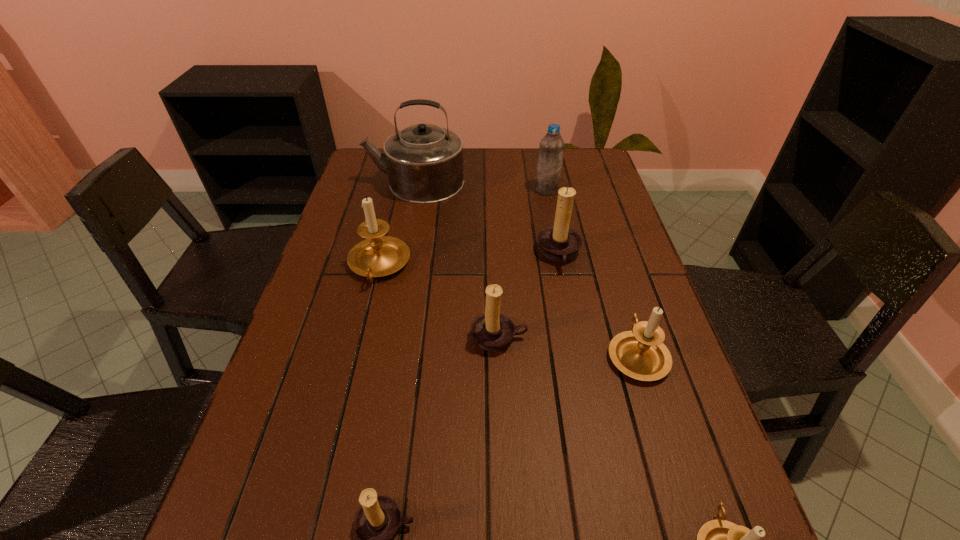
At what (x,y) coordinates should I click in order to perform the action: click on gray kettle. Please return your answer as a coordinate pair (x, y). This screenshot has width=960, height=540. Looking at the image, I should click on (424, 162).

Identify the location of kettle. The width and height of the screenshot is (960, 540). (424, 162).

Identify the location of blue water bottle. The image size is (960, 540). (551, 148).

The height and width of the screenshot is (540, 960). Find the location of `the third candle holder from right to left`. the third candle holder from right to left is located at coordinates (558, 242).

The width and height of the screenshot is (960, 540). I want to click on the farthest brown candle holder, so click(558, 242).

Image resolution: width=960 pixels, height=540 pixels. Identify the location of the farthest beige candle holder. (377, 256).

The image size is (960, 540). Identify the location of the leftmost beige candle holder. (377, 256).

Locate an element on the screen. The height and width of the screenshot is (540, 960). the second farthest beige candle holder is located at coordinates (641, 354).

Where is `the fifth object from right to left`? The image size is (960, 540). the fifth object from right to left is located at coordinates (492, 330).

Where is `the second brown candle holder from right to left`? the second brown candle holder from right to left is located at coordinates pyautogui.click(x=492, y=330).